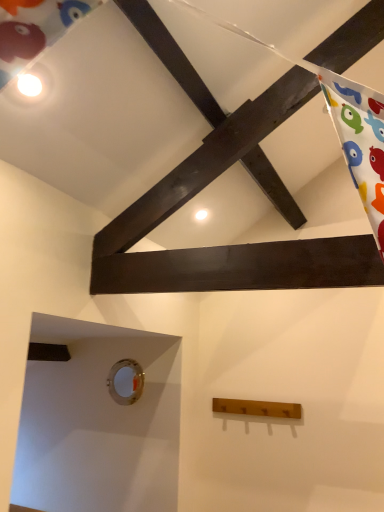
Question: Could you tell me if wooden coat rack at lower center is turned towards metallic circular hole at lower left?

Choices:
 (A) no
 (B) yes

Answer: (A)

Question: Does wooden coat rack at lower center have a lesser height compared to metallic circular hole at lower left?

Choices:
 (A) yes
 (B) no

Answer: (A)

Question: Is wooden coat rack at lower center bigger than metallic circular hole at lower left?

Choices:
 (A) no
 (B) yes

Answer: (B)

Question: From the image's perspective, does wooden coat rack at lower center appear higher than metallic circular hole at lower left?

Choices:
 (A) no
 (B) yes

Answer: (A)

Question: Considering the relative sizes of wooden coat rack at lower center and metallic circular hole at lower left in the image provided, is wooden coat rack at lower center thinner than metallic circular hole at lower left?

Choices:
 (A) no
 (B) yes

Answer: (A)

Question: Is wooden coat rack at lower center not near metallic circular hole at lower left?

Choices:
 (A) no
 (B) yes

Answer: (A)

Question: Is metallic circular hole at lower left behind wooden coat rack at lower center?

Choices:
 (A) no
 (B) yes

Answer: (B)

Question: Can you confirm if metallic circular hole at lower left is thinner than wooden coat rack at lower center?

Choices:
 (A) no
 (B) yes

Answer: (B)

Question: From a real-world perspective, is metallic circular hole at lower left under wooden coat rack at lower center?

Choices:
 (A) yes
 (B) no

Answer: (B)

Question: From a real-world perspective, is metallic circular hole at lower left on top of wooden coat rack at lower center?

Choices:
 (A) yes
 (B) no

Answer: (A)

Question: Is the depth of metallic circular hole at lower left less than that of wooden coat rack at lower center?

Choices:
 (A) yes
 (B) no

Answer: (B)

Question: Is metallic circular hole at lower left facing away from wooden coat rack at lower center?

Choices:
 (A) yes
 (B) no

Answer: (B)

Question: Considering their positions, is metallic circular hole at lower left located in front of or behind wooden coat rack at lower center?

Choices:
 (A) front
 (B) behind

Answer: (B)